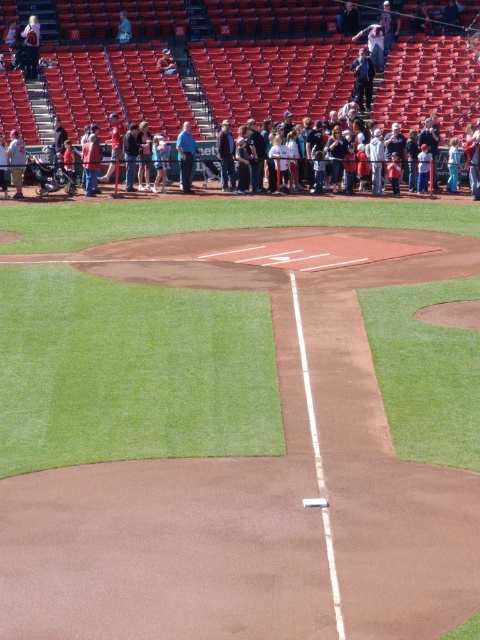
Which is above, blue shirt at center or denim jacket at center?

denim jacket at center is above.

Is blue shirt at center positioned at the back of denim jacket at center?

No.

This screenshot has width=480, height=640. I want to click on blue shirt at center, so click(x=186, y=156).

Who is higher up, blue shirt at center or dark blue shirt at center?

dark blue shirt at center is above.

Measure the distance between blue shirt at center and camera.

blue shirt at center and camera are 26.65 meters apart from each other.

Image resolution: width=480 pixels, height=640 pixels. What are the coordinates of `blue shirt at center` in the screenshot? It's located at (186, 156).

Is dark blue shirt at center bigger than denim jacket at center?

No.

Can you confirm if dark blue shirt at center is positioned to the right of denim jacket at center?

A: Correct, you'll find dark blue shirt at center to the right of denim jacket at center.

Between point (254, 134) and point (222, 125), which one is positioned behind?

Point (222, 125)

This screenshot has height=640, width=480. I want to click on dark blue shirt at center, so click(255, 156).